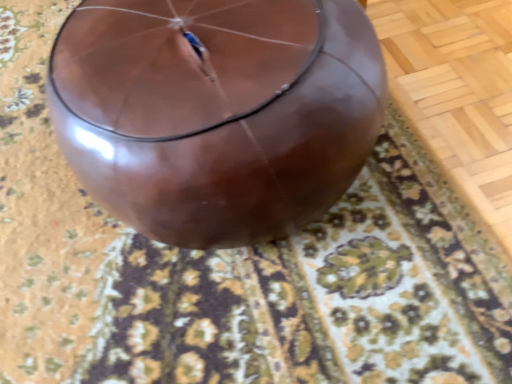
Question: From a real-world perspective, is glossy brown balloon at center located higher than brown glossy mat at center?

Choices:
 (A) no
 (B) yes

Answer: (B)

Question: Considering the relative sizes of glossy brown balloon at center and brown glossy mat at center in the image provided, is glossy brown balloon at center taller than brown glossy mat at center?

Choices:
 (A) no
 (B) yes

Answer: (B)

Question: Could you tell me if glossy brown balloon at center is turned towards brown glossy mat at center?

Choices:
 (A) no
 (B) yes

Answer: (A)

Question: Is glossy brown balloon at center to the right of brown glossy mat at center from the viewer's perspective?

Choices:
 (A) no
 (B) yes

Answer: (B)

Question: Is glossy brown balloon at center next to brown glossy mat at center and touching it?

Choices:
 (A) yes
 (B) no

Answer: (B)

Question: From the image's perspective, is glossy brown balloon at center below brown glossy mat at center?

Choices:
 (A) yes
 (B) no

Answer: (A)

Question: Can you confirm if brown glossy mat at center is bigger than glossy brown balloon at center?

Choices:
 (A) yes
 (B) no

Answer: (B)

Question: From a real-world perspective, is brown glossy mat at center physically below glossy brown balloon at center?

Choices:
 (A) no
 (B) yes

Answer: (B)

Question: From the image's perspective, is brown glossy mat at center under glossy brown balloon at center?

Choices:
 (A) no
 (B) yes

Answer: (A)

Question: Is brown glossy mat at center next to glossy brown balloon at center and touching it?

Choices:
 (A) no
 (B) yes

Answer: (A)

Question: Is brown glossy mat at center shorter than glossy brown balloon at center?

Choices:
 (A) yes
 (B) no

Answer: (A)

Question: Does brown glossy mat at center have a lesser width compared to glossy brown balloon at center?

Choices:
 (A) no
 (B) yes

Answer: (A)

Question: Is glossy brown balloon at center wider or thinner than brown glossy mat at center?

Choices:
 (A) wide
 (B) thin

Answer: (B)